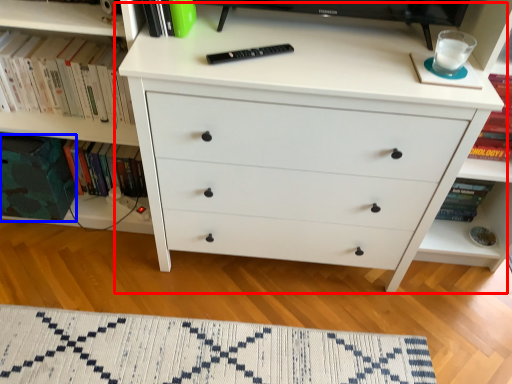
Question: Which object appears closest to the camera in this image, chest of drawers (highlighted by a red box) or paperback book (highlighted by a blue box)?

Choices:
 (A) chest of drawers
 (B) paperback book

Answer: (A)